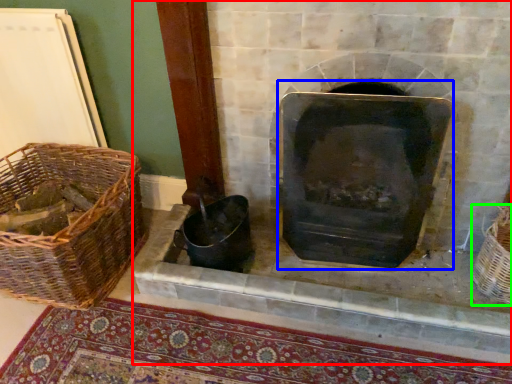
Question: Estimate the real-world distances between objects in this image. Which object is farther from fireplace (highlighted by a red box), wood burning stove (highlighted by a blue box) or basket (highlighted by a green box)?

Choices:
 (A) wood burning stove
 (B) basket

Answer: (B)